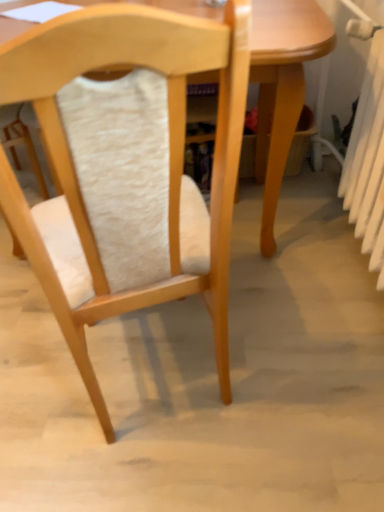
Question: Can you confirm if wooden chair at center is smaller than white plastic radiator at right?

Choices:
 (A) yes
 (B) no

Answer: (B)

Question: From the image's perspective, would you say wooden chair at center is shown under white plastic radiator at right?

Choices:
 (A) no
 (B) yes

Answer: (B)

Question: Is wooden chair at center not within white plastic radiator at right?

Choices:
 (A) yes
 (B) no

Answer: (A)

Question: Is the position of wooden chair at center less distant than that of white plastic radiator at right?

Choices:
 (A) yes
 (B) no

Answer: (A)

Question: From a real-world perspective, is wooden chair at center beneath white plastic radiator at right?

Choices:
 (A) no
 (B) yes

Answer: (A)

Question: From a real-world perspective, is wooden chair at center positioned above or below light wood table at center?

Choices:
 (A) above
 (B) below

Answer: (A)

Question: Relative to light wood table at center, is wooden chair at center in front or behind?

Choices:
 (A) behind
 (B) front

Answer: (B)

Question: Is point (102, 109) closer or farther from the camera than point (269, 15)?

Choices:
 (A) farther
 (B) closer

Answer: (B)

Question: Is wooden chair at center taller or shorter than light wood table at center?

Choices:
 (A) short
 (B) tall

Answer: (B)

Question: Considering the relative positions of light wood table at center and white plastic radiator at right in the image provided, is light wood table at center to the left or to the right of white plastic radiator at right?

Choices:
 (A) left
 (B) right

Answer: (A)

Question: Considering the positions of light wood table at center and white plastic radiator at right in the image, is light wood table at center bigger or smaller than white plastic radiator at right?

Choices:
 (A) small
 (B) big

Answer: (B)

Question: From a real-world perspective, is light wood table at center physically located above or below white plastic radiator at right?

Choices:
 (A) above
 (B) below

Answer: (B)

Question: Considering their positions, is light wood table at center located in front of or behind white plastic radiator at right?

Choices:
 (A) behind
 (B) front

Answer: (A)

Question: Looking at the image, does white plastic radiator at right seem bigger or smaller compared to wooden chair at center?

Choices:
 (A) small
 (B) big

Answer: (A)

Question: From a real-world perspective, is white plastic radiator at right above or below wooden chair at center?

Choices:
 (A) above
 (B) below

Answer: (B)